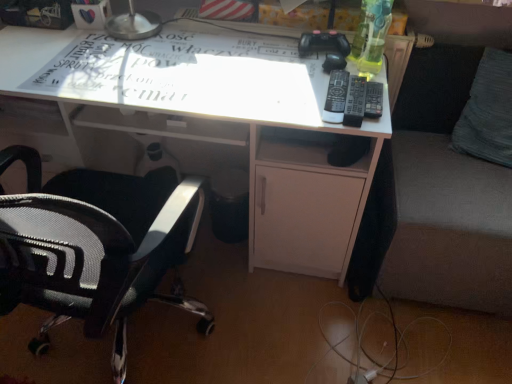
Question: From a real-world perspective, is white glossy desk at center positioned under white paper at center based on gravity?

Choices:
 (A) yes
 (B) no

Answer: (A)

Question: From the image's perspective, is white glossy desk at center under white paper at center?

Choices:
 (A) yes
 (B) no

Answer: (A)

Question: Is white glossy desk at center to the right of white paper at center from the viewer's perspective?

Choices:
 (A) yes
 (B) no

Answer: (B)

Question: From a real-world perspective, is white glossy desk at center located higher than white paper at center?

Choices:
 (A) yes
 (B) no

Answer: (B)

Question: Is white glossy desk at center in front of white paper at center?

Choices:
 (A) yes
 (B) no

Answer: (A)

Question: Is white glossy desk at center far from white paper at center?

Choices:
 (A) yes
 (B) no

Answer: (B)

Question: Does black plastic remote at upper right, the third remote from the right, turn towards black mesh office chair at left?

Choices:
 (A) no
 (B) yes

Answer: (A)

Question: Considering the relative sizes of black plastic remote at upper right, the third remote from the right, and black mesh office chair at left in the image provided, is black plastic remote at upper right, the third remote from the right, smaller than black mesh office chair at left?

Choices:
 (A) yes
 (B) no

Answer: (A)

Question: Can you see black plastic remote at upper right, which ranks as the 1th remote in left-to-right order, touching black mesh office chair at left?

Choices:
 (A) no
 (B) yes

Answer: (A)

Question: From the image's perspective, is black plastic remote at upper right, which ranks as the 1th remote in left-to-right order, on top of black mesh office chair at left?

Choices:
 (A) yes
 (B) no

Answer: (A)

Question: Is black plastic remote at upper right, which ranks as the 1th remote in left-to-right order, turned away from black mesh office chair at left?

Choices:
 (A) yes
 (B) no

Answer: (B)

Question: Can we say black plastic remote at upper right, which ranks as the 1th remote in left-to-right order, lies outside black mesh office chair at left?

Choices:
 (A) yes
 (B) no

Answer: (A)

Question: Could black plastic remote at upper right, which ranks as the 1th remote in left-to-right order, be considered to be inside black plastic remote at right, the second remote when ordered from right to left?

Choices:
 (A) no
 (B) yes

Answer: (A)